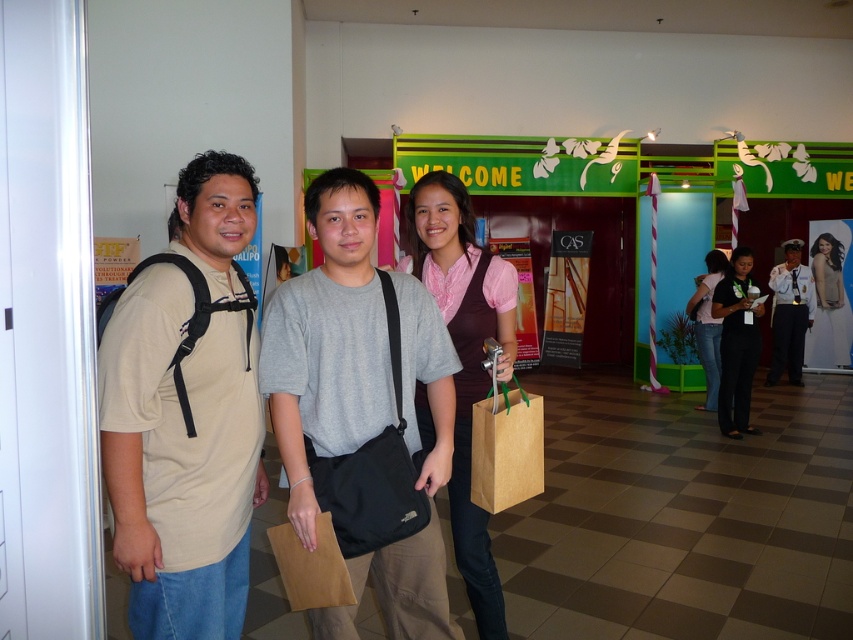
You are standing in the hallway and need to locate the matte gray shirt at center. According to the coordinates provided, where would you find it?

The matte gray shirt at center is located at the 2D coordinates point (410,584).

You are a photographer positioned at the entrance. You want to take a photo of the matte gray shirt at center and the matte pink shirt at right so that both are clearly visible. Based on their positions, which person should you ask to move slightly backward to ensure both are in focus?

The matte gray shirt at center is in front of the matte pink shirt at right, so you should ask the matte gray shirt at center to move slightly backward to ensure both are in focus.

You are navigating through the hallway and need to reach the entrance marked by the red door. There are two points in your path labeled as point [224,212] and point [494,314]. Which point should you pass first to reach the entrance?

You should pass point [224,212] first because it is in front of point [494,314], meaning it is closer to your current position towards the entrance.